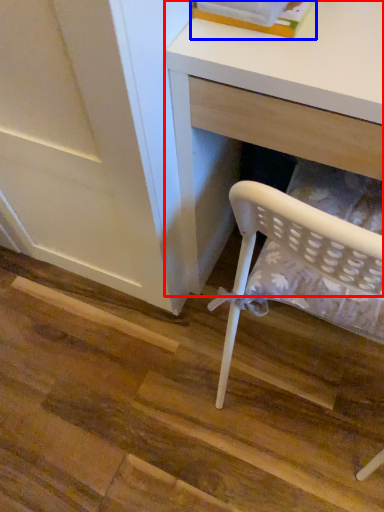
Question: Which of the following is the closest to the observer, desk (highlighted by a red box) or book (highlighted by a blue box)?

Choices:
 (A) desk
 (B) book

Answer: (A)